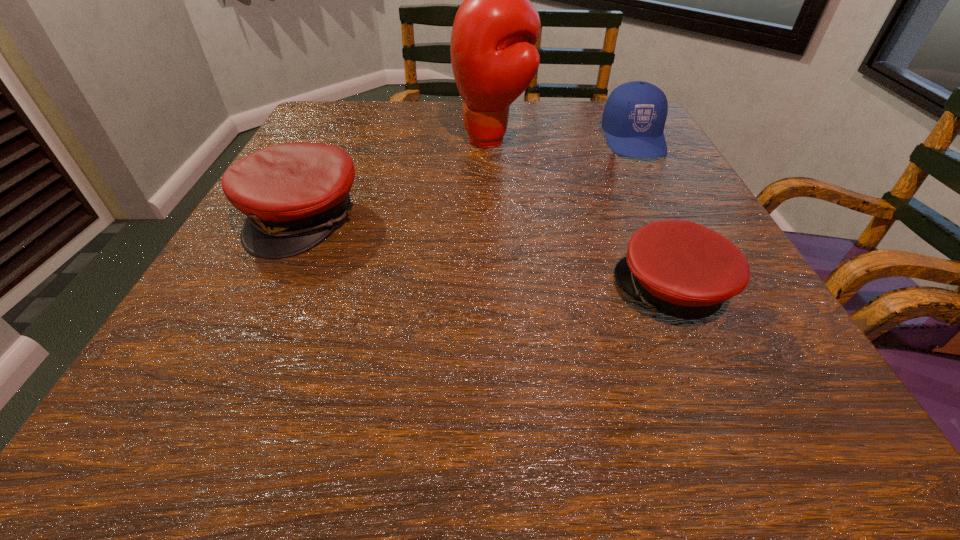
Where is `vacant space located on the front-facing side of the shortest cap`? The height and width of the screenshot is (540, 960). vacant space located on the front-facing side of the shortest cap is located at coordinates (529, 291).

Where is `vacant space positioned on the front-facing side of the shortest cap`? vacant space positioned on the front-facing side of the shortest cap is located at coordinates (555, 291).

You are a GUI agent. You are given a task and a screenshot of the screen. Output one action in this format:
    pyautogui.click(x=<x>, y=<y>)
    Task: Click on the vacant space located 0.390m on the front-facing side of the shortest cap
    This screenshot has width=960, height=540.
    Given the screenshot: What is the action you would take?
    pyautogui.click(x=369, y=291)

Locate an element on the screen. Image resolution: width=960 pixels, height=540 pixels. boxing glove that is at the far edge is located at coordinates (494, 60).

This screenshot has height=540, width=960. Find the location of `cap at the far edge`. cap at the far edge is located at coordinates (634, 116).

The image size is (960, 540). Identify the location of object present at the left edge. (294, 194).

Locate an element on the screen. The image size is (960, 540). object that is at the far right corner is located at coordinates (634, 116).

Where is `free region at the far edge`? free region at the far edge is located at coordinates (401, 127).

The height and width of the screenshot is (540, 960). In order to click on free space at the near edge of the desktop in this screenshot , I will do `click(712, 451)`.

Image resolution: width=960 pixels, height=540 pixels. What are the coordinates of `vacant point at the left edge` in the screenshot? It's located at (268, 361).